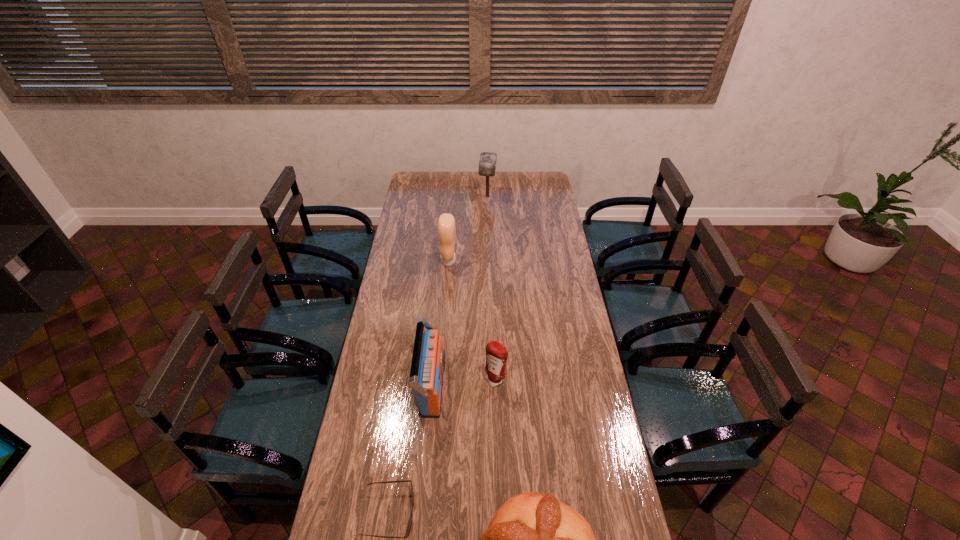
The width and height of the screenshot is (960, 540). Find the location of `the farthest object`. the farthest object is located at coordinates (487, 165).

Where is `the farther condiment`? The image size is (960, 540). the farther condiment is located at coordinates (446, 223).

Identify the location of the taller condiment. (446, 223).

The height and width of the screenshot is (540, 960). What are the coordinates of `radio receiver` in the screenshot? It's located at (428, 361).

You are a GUI agent. You are given a task and a screenshot of the screen. Output one action in this format:
    pyautogui.click(x=<x>, y=<y>)
    Task: Click on the right condiment
    This screenshot has width=960, height=540.
    Given the screenshot: What is the action you would take?
    pyautogui.click(x=496, y=354)

Where is `the shorter condiment`? The height and width of the screenshot is (540, 960). the shorter condiment is located at coordinates (496, 354).

Where is `free space located on the left of the farthest object`? This screenshot has width=960, height=540. free space located on the left of the farthest object is located at coordinates (451, 197).

At what (x,y) coordinates should I click in order to perform the action: click on free location located on the label of the taller condiment. Please return your answer as a coordinate pair (x, y). The height and width of the screenshot is (540, 960). Looking at the image, I should click on (508, 261).

Image resolution: width=960 pixels, height=540 pixels. In order to click on vacant space located 0.100m on the front-facing side of the radio receiver in this screenshot , I will do `click(471, 387)`.

The image size is (960, 540). In order to click on blank space located on the left of the right condiment in this screenshot , I will do `click(441, 380)`.